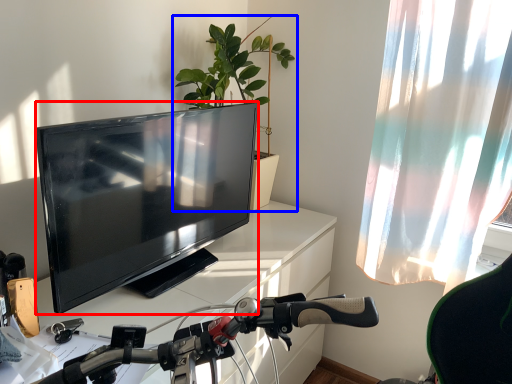
Question: Among these objects, which one is nearest to the camera, television (highlighted by a red box) or houseplant (highlighted by a blue box)?

Choices:
 (A) television
 (B) houseplant

Answer: (A)